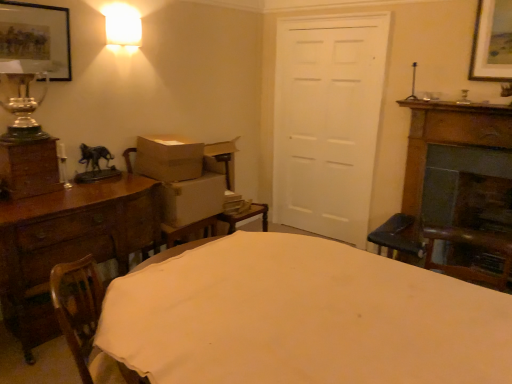
Measure the distance between matte glass lampshade at upper left and camera.

matte glass lampshade at upper left and camera are 9.02 feet apart.

At what (x,y) coordinates should I click in order to perform the action: click on shiny glass vase at left. Please return your answer as a coordinate pair (x, y). The width and height of the screenshot is (512, 384). Looking at the image, I should click on (23, 106).

Image resolution: width=512 pixels, height=384 pixels. What do you see at coordinates (302, 317) in the screenshot?
I see `white cloth-covered table at center` at bounding box center [302, 317].

At what (x,y) coordinates should I click in order to perform the action: click on matte glass lampshade at upper left. Please return your answer as a coordinate pair (x, y). This screenshot has width=512, height=384. Looking at the image, I should click on (122, 25).

Is white matte door at center not close to shiny glass vase at left?

Absolutely, white matte door at center is distant from shiny glass vase at left.

I want to click on table lamp on the left of white matte door at center, so click(23, 106).

Is white matte door at center smaller than shiny glass vase at left?

Incorrect, white matte door at center is not smaller in size than shiny glass vase at left.

Is the position of white matte door at center more distant than that of shiny glass vase at left?

Yes, it is behind shiny glass vase at left.

Can you confirm if white cloth-covered table at center is smaller than matte black picture frame at upper left?

No, white cloth-covered table at center is not smaller than matte black picture frame at upper left.

Is matte black picture frame at upper left at the back of white cloth-covered table at center?

No.

From their relative heights in the image, would you say white cloth-covered table at center is taller or shorter than matte black picture frame at upper left?

Clearly, white cloth-covered table at center is taller compared to matte black picture frame at upper left.

Is matte glass lampshade at upper left oriented away from wooden swivel chair at lower left?

No, wooden swivel chair at lower left is not at the back of matte glass lampshade at upper left.

How many degrees apart are the facing directions of matte glass lampshade at upper left and wooden swivel chair at lower left?

52.6 degrees.

Between matte glass lampshade at upper left and wooden swivel chair at lower left, which one has more height?

wooden swivel chair at lower left is taller.

Does point (334, 242) lie in front of point (482, 139)?

Yes, point (334, 242) is closer to viewer.

From the image's perspective, is white cloth-covered table at center below wooden fireplace at right?

Yes, from the image's perspective, white cloth-covered table at center is below wooden fireplace at right.

What are the coordinates of `table lying in front of the wooden fireplace at right` in the screenshot? It's located at (302, 317).

Does white cloth-covered table at center have a lesser height compared to wooden fireplace at right?

Yes.

Which is in front, point (133, 244) or point (6, 34)?

The point (6, 34) is more forward.

Is wooden chest of drawers at left behind matte black picture frame at upper left?

No, wooden chest of drawers at left is closer to the viewer.

Is wooden chest of drawers at left aimed at matte black picture frame at upper left?

No.

Which point is more distant from viewer, (7, 47) or (234, 305)?

The point (7, 47) is farther.

This screenshot has height=384, width=512. In order to click on picture frame located behind the white cloth-covered table at center in this screenshot , I will do `click(36, 36)`.

Is matte black picture frame at upper left far away from white cloth-covered table at center?

matte black picture frame at upper left is far away from white cloth-covered table at center.

Which of these two, white cloth-covered table at center or matte glass lampshade at upper left, stands taller?

Standing taller between the two is white cloth-covered table at center.

From the image's perspective, which is above, white cloth-covered table at center or matte glass lampshade at upper left?

matte glass lampshade at upper left is shown above in the image.

From a real-world perspective, which object rests below the other?

In real-world perspective, white cloth-covered table at center is lower.

Which is in front, white cloth-covered table at center or matte glass lampshade at upper left?

white cloth-covered table at center is in front.

In order to click on door located underneath the shiny glass vase at left (from a real-world perspective) in this screenshot , I will do `click(327, 122)`.

The width and height of the screenshot is (512, 384). I want to click on table that is in front of the matte black picture frame at upper left, so click(302, 317).

Considering their positions, is shiny glass vase at left positioned further to wooden chest of drawers at left than brown cardboard box at center, marked as the 2th cardboard box in a bottom-to-top arrangement?

shiny glass vase at left is further to wooden chest of drawers at left.

When comparing their distances from white cloth-covered table at center, does shiny glass vase at left or wooden swivel chair at lower left seem further?

Among the two, shiny glass vase at left is located further to white cloth-covered table at center.

When comparing their distances from matte black picture frame at upper left, does wooden fireplace at right or brown cardboard box at center, the first cardboard box when ordered from top to bottom, seem closer?

The object closer to matte black picture frame at upper left is brown cardboard box at center, the first cardboard box when ordered from top to bottom.

Considering their positions, is brown cardboard box at center, the first cardboard box when ordered from top to bottom, positioned closer to wooden fireplace at right than white cardboard box at left, which appears as the 2th cardboard box when viewed from the top?

Among the two, white cardboard box at left, which appears as the 2th cardboard box when viewed from the top, is located nearer to wooden fireplace at right.

Which object lies further to the anchor point wooden swivel chair at lower left, brown cardboard box at center, marked as the 2th cardboard box in a bottom-to-top arrangement, or wooden fireplace at right?

wooden fireplace at right is further to wooden swivel chair at lower left.

Considering their positions, is shiny glass vase at left positioned closer to wooden fireplace at right than matte glass lampshade at upper left?

matte glass lampshade at upper left is positioned closer to the anchor wooden fireplace at right.

Consider the image. From the image, which object appears to be farther from white matte door at center, brown cardboard box at center, marked as the 2th cardboard box in a bottom-to-top arrangement, or shiny glass vase at left?

shiny glass vase at left is positioned further to the anchor white matte door at center.

Based on their spatial positions, is wooden chest of drawers at left or wooden swivel chair at lower left closer to matte glass lampshade at upper left?

Among the two, wooden chest of drawers at left is located nearer to matte glass lampshade at upper left.

Where is `chest of drawers between matte glass lampshade at upper left and wooden swivel chair at lower left from top to bottom`? The height and width of the screenshot is (384, 512). chest of drawers between matte glass lampshade at upper left and wooden swivel chair at lower left from top to bottom is located at coordinates (70, 240).

The height and width of the screenshot is (384, 512). I want to click on lamp between matte black picture frame at upper left and white matte door at center, so click(x=122, y=25).

Find the location of a particular element. lamp between wooden swivel chair at lower left and white matte door at center along the z-axis is located at coordinates (122, 25).

Image resolution: width=512 pixels, height=384 pixels. I want to click on swivel chair between white cloth-covered table at center and matte glass lampshade at upper left in the front-back direction, so click(x=84, y=320).